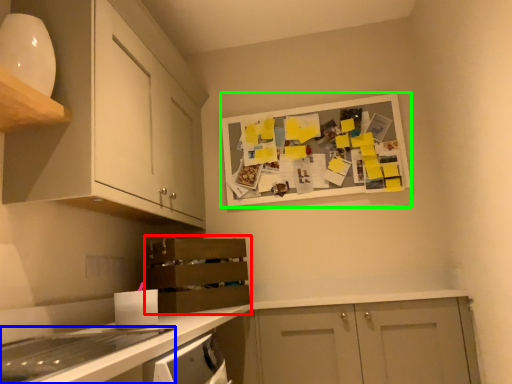
Question: Which object is the farthest from shelf (highlighted by a red box)? Choose among these: home appliance (highlighted by a blue box) or bulletin board (highlighted by a green box).

Choices:
 (A) home appliance
 (B) bulletin board

Answer: (A)